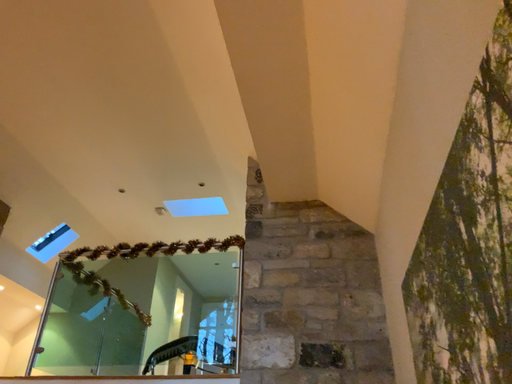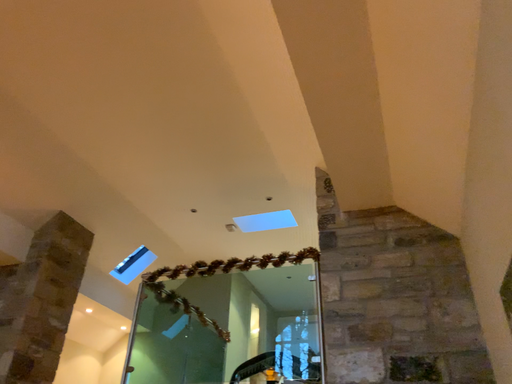
Question: How did the camera likely rotate when shooting the video?

Choices:
 (A) rotated right
 (B) rotated left

Answer: (B)